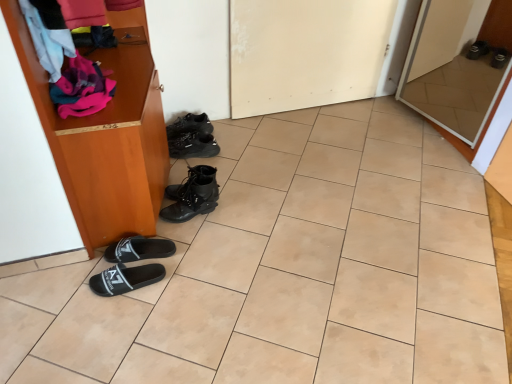
The width and height of the screenshot is (512, 384). Find the location of `free space to the right of black fabric slipper at lower left, the 1th footwear when ordered from bottom to top`. free space to the right of black fabric slipper at lower left, the 1th footwear when ordered from bottom to top is located at coordinates (182, 287).